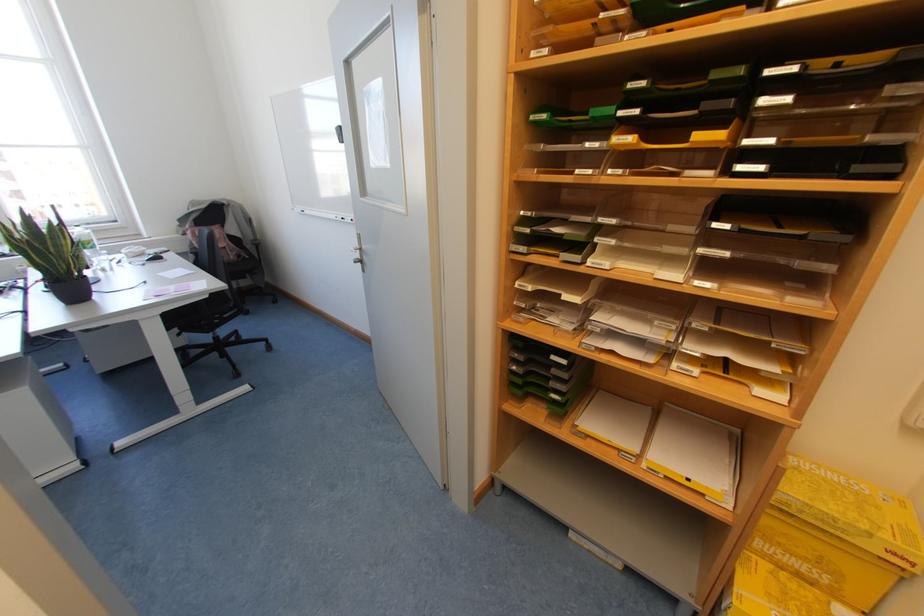
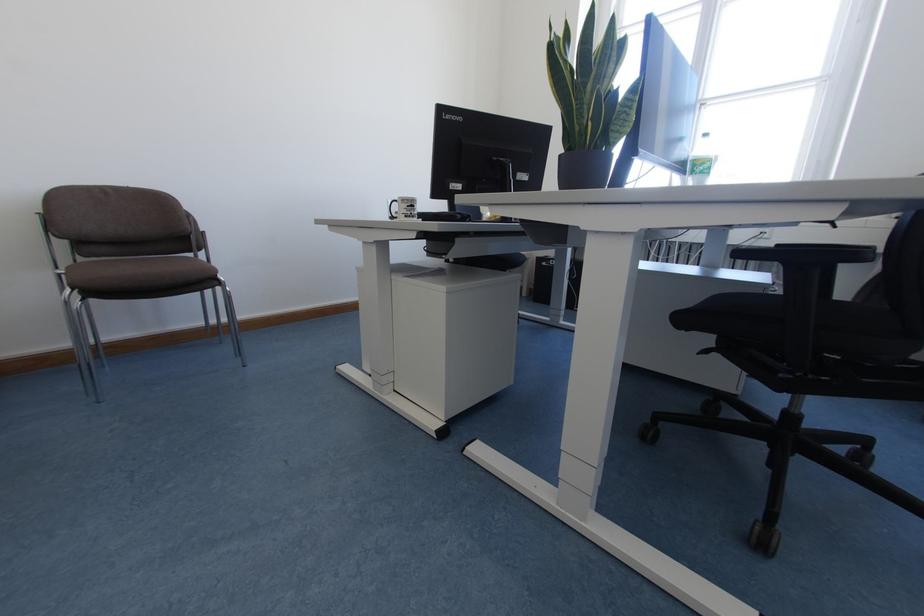
Find the pixel in the second image that matches (x=82, y=244) in the first image.

(694, 164)